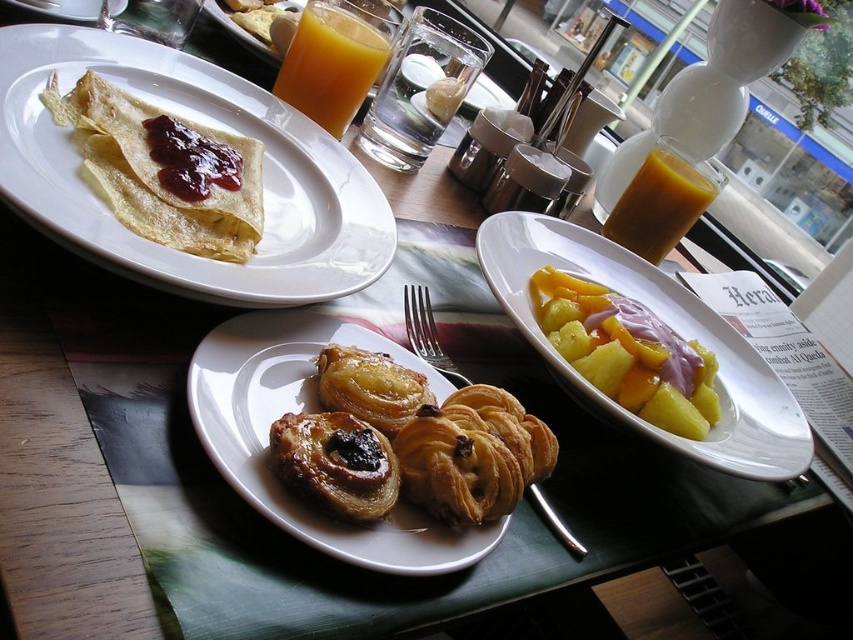
Question: Is golden brown pastry at center wider than yellow pineapple at center?

Choices:
 (A) yes
 (B) no

Answer: (A)

Question: Which point is closer to the camera?

Choices:
 (A) (653, 256)
 (B) (219, 179)

Answer: (B)

Question: Which is nearer to the golden brown pastry at center?

Choices:
 (A) glazed golden-brown pastry at center
 (B) translucent glass cup of orange juice at upper right
 (C) shiny red jam at center
 (D) matte brown crepe at upper left

Answer: (A)

Question: Which of the following is the closest to the observer?

Choices:
 (A) translucent glass orange juice at upper center
 (B) yellow matte pineapple at center
 (C) yellow pineapple at center

Answer: (B)

Question: Is golden brown pastry at center bigger than matte brown crepe at upper left?

Choices:
 (A) no
 (B) yes

Answer: (B)

Question: Does yellow matte pineapple at center have a larger size compared to yellow pineapple at center?

Choices:
 (A) yes
 (B) no

Answer: (A)